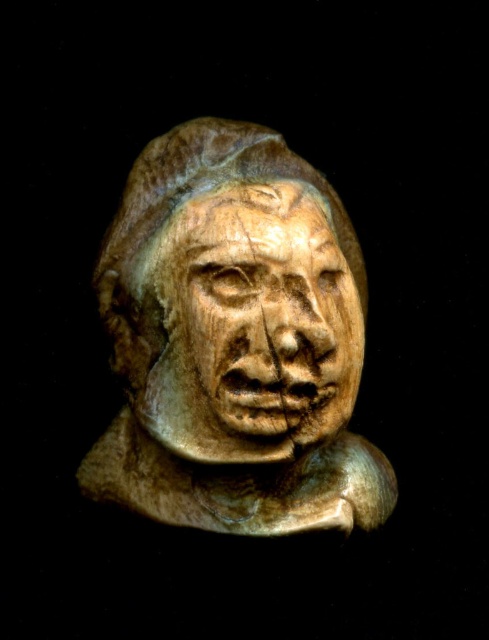
Question: Does matte stone bust at center have a smaller size compared to wooden carving at center?

Choices:
 (A) no
 (B) yes

Answer: (A)

Question: Does matte stone bust at center appear over wooden carving at center?

Choices:
 (A) no
 (B) yes

Answer: (A)

Question: Which object is closer to the camera taking this photo?

Choices:
 (A) wooden carving at center
 (B) matte stone bust at center

Answer: (A)

Question: Can you confirm if matte stone bust at center is thinner than wooden carving at center?

Choices:
 (A) yes
 (B) no

Answer: (B)

Question: Which of the following is the farthest from the observer?

Choices:
 (A) (251, 380)
 (B) (216, 445)

Answer: (B)